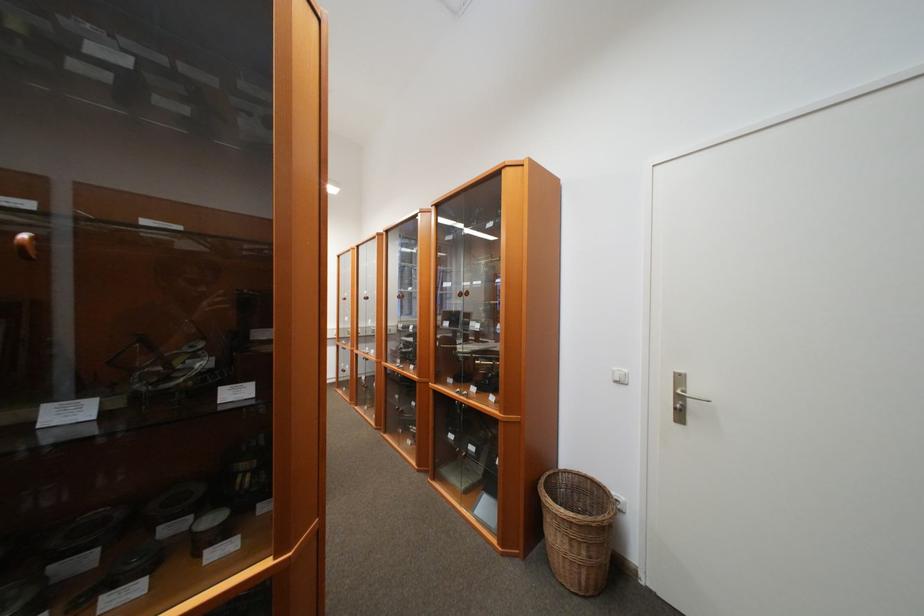
Find the location of a particular element. The image size is (924, 616). wicker basket is located at coordinates (578, 529).